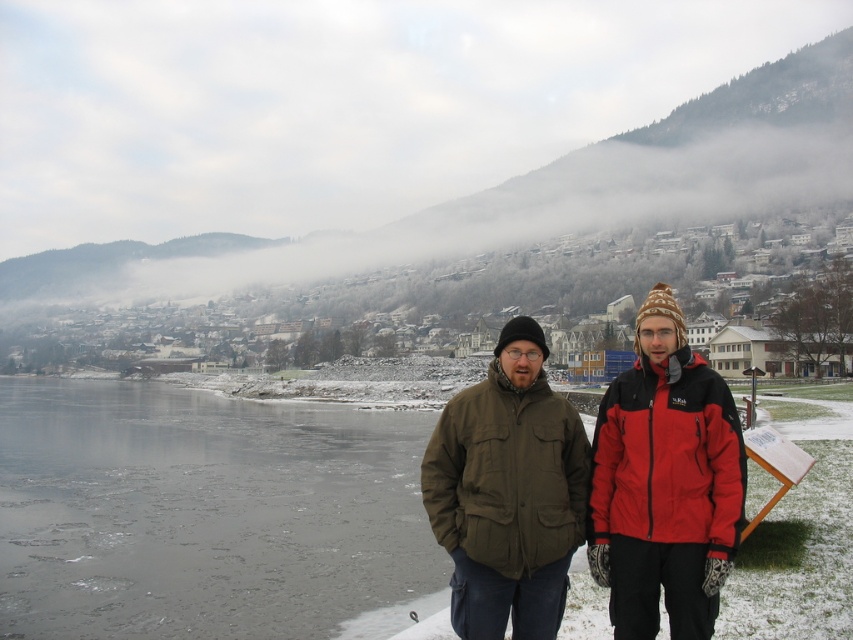
You are a photographer positioned at the center of the image. You want to capture a shot that includes both the matte green jacket at center and the icy surface visible in the lower left. Which direction should you move to ensure both elements are in frame?

The matte green jacket at center is located at point [664,483], so you should move towards the lower left to include both the jacket and the icy surface in the frame.

You are a photographer trying to capture both the red fleece jacket at center and the olive green fabric jacket at center in a single shot. Since you want to ensure both are in focus, which jacket should you focus on first to account for their positions?

You should focus on the red fleece jacket at center first because it is closer to the viewer than the olive green fabric jacket at center. By focusing on the closer object, you can ensure that both jackets will be in focus using the depth of field.

You are a photographer trying to capture both the red fleece jacket at center and the olive green fabric jacket at center in a single frame. Which jacket will appear taller in the photo?

The olive green fabric jacket at center will appear taller in the photo since it is taller than the red fleece jacket at center.